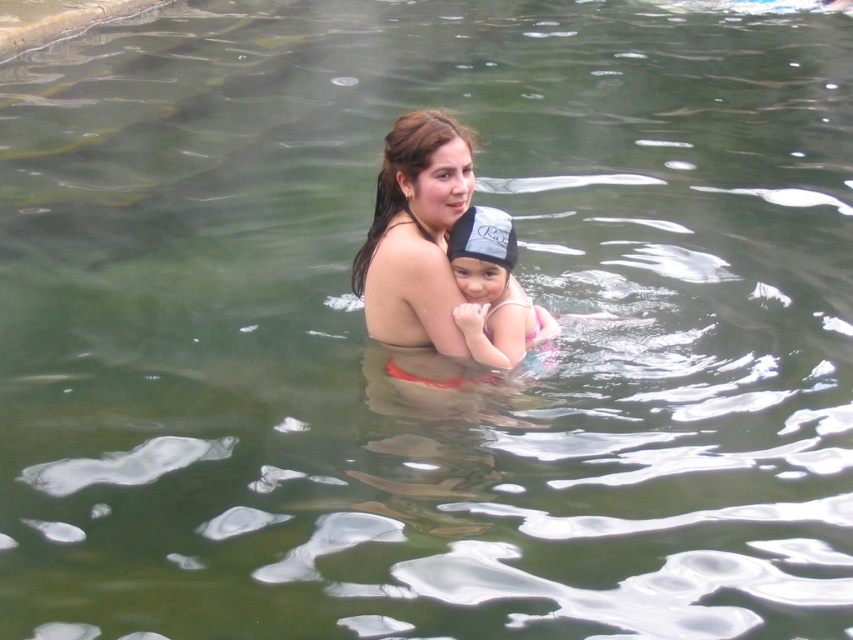
Does dark brown hair at center have a lesser width compared to pink fabric swimsuit at center?

No, dark brown hair at center is not thinner than pink fabric swimsuit at center.

Between point (402, 198) and point (505, 346), which one is positioned in front?

Point (402, 198) is in front.

Image resolution: width=853 pixels, height=640 pixels. I want to click on dark brown hair at center, so click(415, 234).